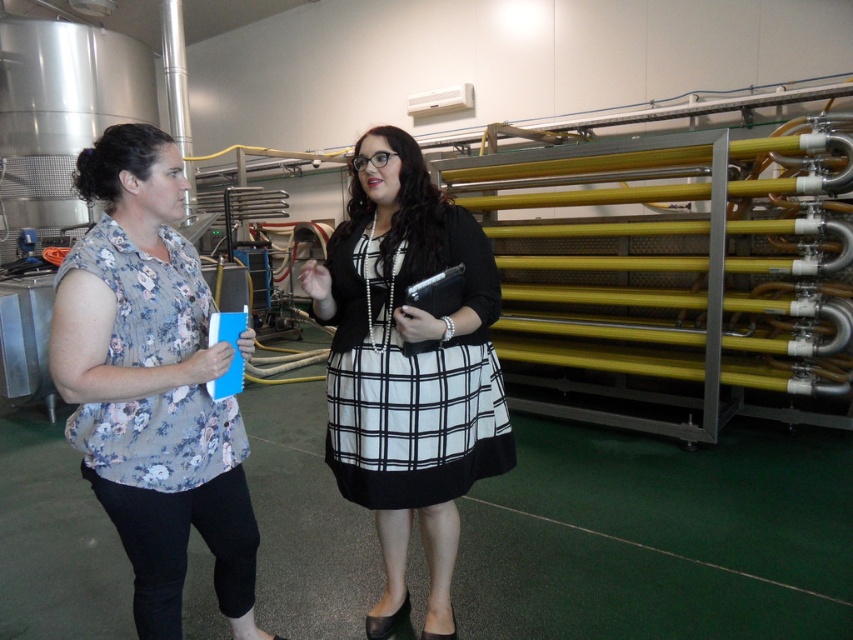
What is the purpose of the point located at coordinates (x=152, y=385) in the image?

The point at coordinates (x=152, y=385) is on the floral fabric blouse at left.

Based on the photo, you are an interior designer observing the industrial setting. You notice the floral fabric blouse at left and the matte black dress at center. Which of these two items has a smaller size?

The floral fabric blouse at left has a smaller size compared to the matte black dress at center.

You are an inspector in the facility. You need to check the safety of the clothing worn by the workers. According to the company policy, all clothing must be made of fire retardant material. The floral fabric blouse at left and the matte black dress at center are the two clothing items in question. Which clothing item is positioned lower in the image?

The floral fabric blouse at left is below matte black dress at center, so the floral fabric blouse at left is positioned lower in the image.